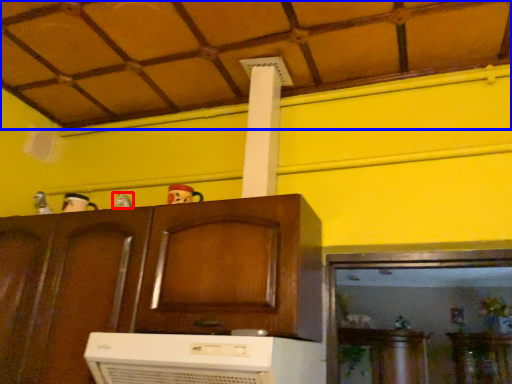
Question: Which object is further to the camera taking this photo, toy (highlighted by a red box) or tile roof (highlighted by a blue box)?

Choices:
 (A) toy
 (B) tile roof

Answer: (A)